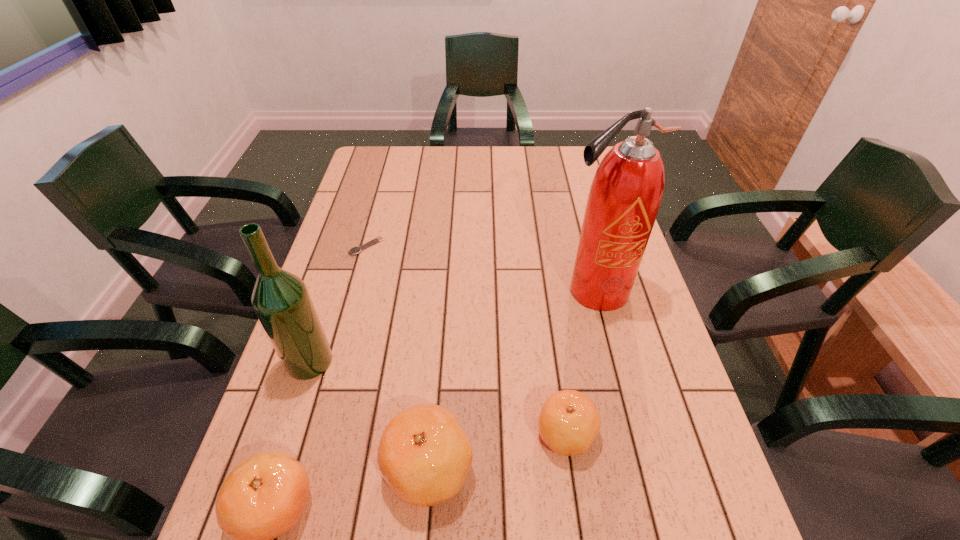
Locate an element on the screen. vacant space located 0.230m on the left of the fifth tallest object is located at coordinates (423, 434).

Locate an element on the screen. vacant space located 0.290m on the front of the farthest object is located at coordinates (342, 336).

At what (x,y) coordinates should I click in order to perform the action: click on blank area located 0.160m on the front of the alcohol. Please return your answer as a coordinate pair (x, y). This screenshot has width=960, height=540. Looking at the image, I should click on (280, 451).

The width and height of the screenshot is (960, 540). What are the coordinates of `vacant space located on the front of the tallest object` in the screenshot? It's located at (613, 368).

Identify the location of watch present at the left edge. Image resolution: width=960 pixels, height=540 pixels. pyautogui.click(x=355, y=250).

I want to click on alcohol located in the left edge section of the desktop, so click(280, 299).

The height and width of the screenshot is (540, 960). In order to click on object situated at the right edge in this screenshot , I will do `click(626, 192)`.

Locate an element on the screen. This screenshot has width=960, height=540. vacant area at the far edge of the desktop is located at coordinates (551, 167).

In the image, there is a desktop. Where is `free space at the left edge`? This screenshot has height=540, width=960. free space at the left edge is located at coordinates (376, 264).

The height and width of the screenshot is (540, 960). Identify the location of free space at the right edge of the desktop. (578, 192).